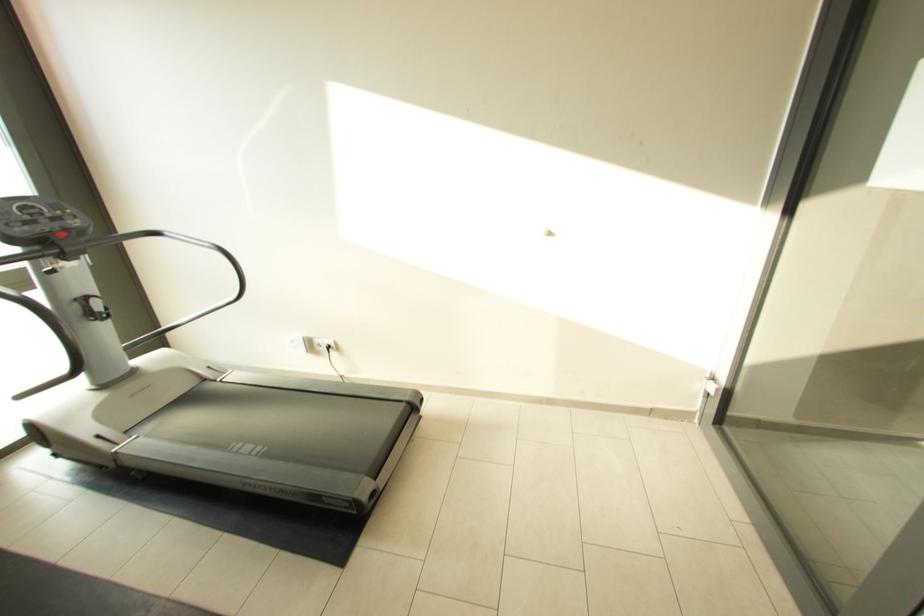
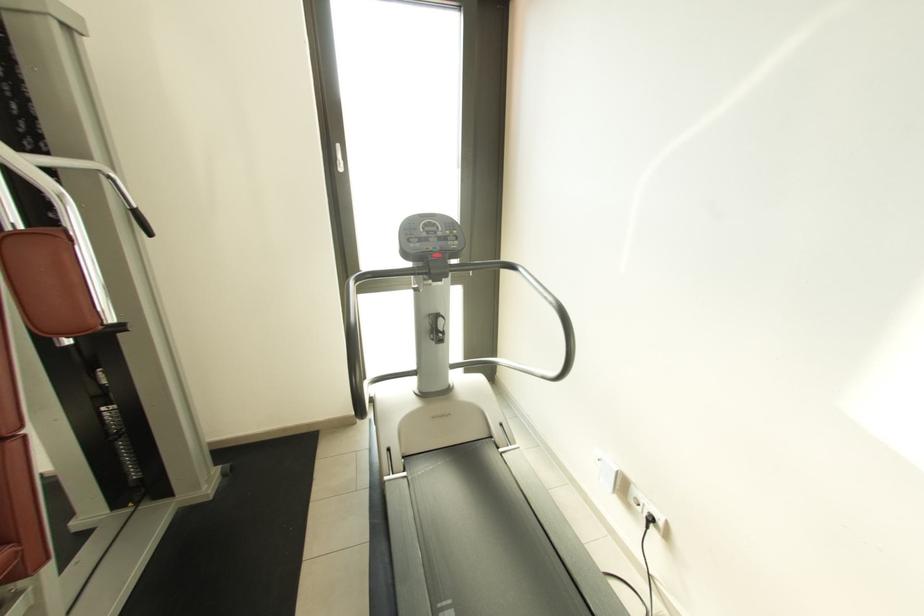
Locate, in the second image, the point that corresponds to (237,447) in the first image.

(450, 605)